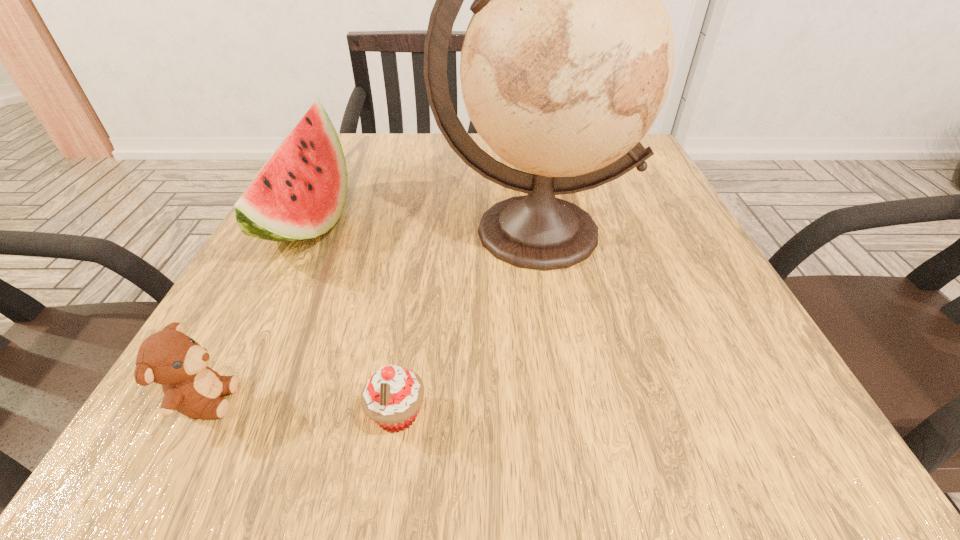
Image resolution: width=960 pixels, height=540 pixels. What are the coordinates of `globe` in the screenshot? It's located at (567, 61).

Locate an element on the screen. This screenshot has height=540, width=960. the second tallest object is located at coordinates (300, 194).

This screenshot has height=540, width=960. Identify the location of teddy bear. (170, 358).

Where is `the shortest object`? The width and height of the screenshot is (960, 540). the shortest object is located at coordinates (392, 396).

You are a GUI agent. You are given a task and a screenshot of the screen. Output one action in this format:
    pyautogui.click(x=<x>, y=<y>)
    Task: Click on the vacant space positioned 0.170m on the front-facing side of the globe
    Image resolution: width=960 pixels, height=540 pixels.
    Given the screenshot: What is the action you would take?
    pyautogui.click(x=556, y=377)

The width and height of the screenshot is (960, 540). I want to click on vacant space located on the outer rind of the second tallest object, so click(x=516, y=224).

The width and height of the screenshot is (960, 540). What are the coordinates of `blank area located on the face of the teddy bear` in the screenshot? It's located at (439, 400).

Locate an element on the screen. The image size is (960, 540). vacant space located 0.280m on the right of the shortest object is located at coordinates (661, 415).

Image resolution: width=960 pixels, height=540 pixels. I want to click on object that is at the far edge, so click(300, 194).

Identify the location of teddy bear positioned at the near edge. (170, 358).